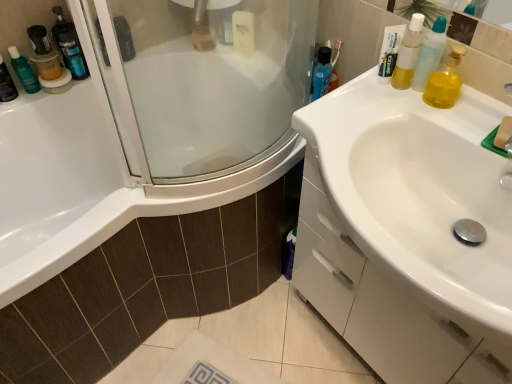
At what (x,y) coordinates should I click in order to perform the action: click on vacant space that is to the left of translucent plastic mouthwash at upper right, which is the first mouthwash in right-to-left order. Please return your answer as a coordinate pair (x, y). Looking at the image, I should click on (353, 99).